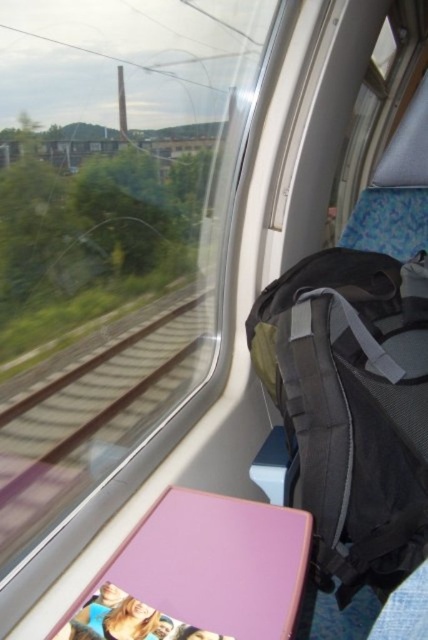
You are sitting on the train seat and looking out the window. You see the black fabric backpack at right and the brown metal train track at left. Which object is closer to your right side?

The black fabric backpack at right is closer to your right side because it is positioned on the right side of the brown metal train track at left.

You are a passenger on the train and need to place your black fabric backpack at right on the seat next to the brown metal train track at left. Is there enough space for both items side by side?

The black fabric backpack at right might be wider than brown metal train track at left, so there may not be enough space for both items side by side.